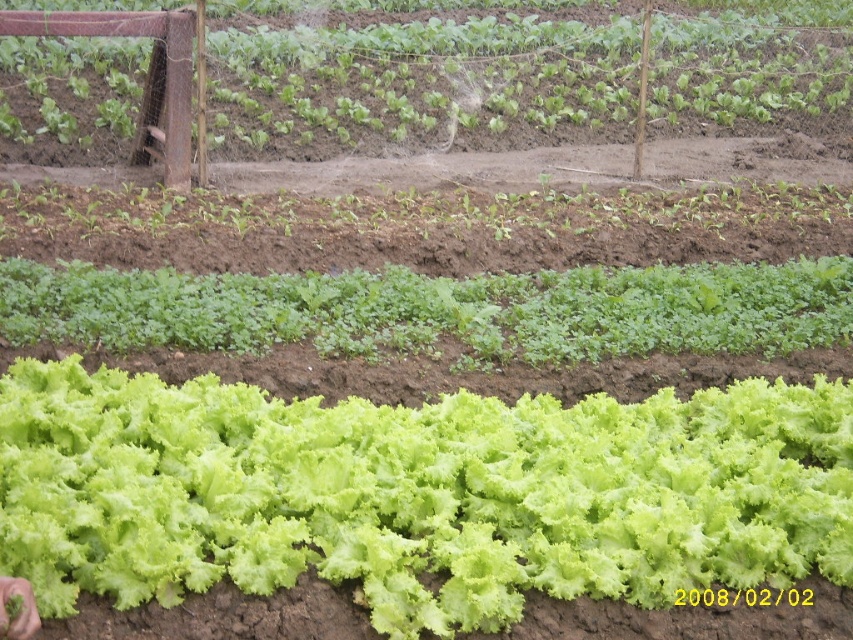
You are a gardener checking the growth of plants in the vegetable garden. You notice the green leafy lettuce at lower center and the green leafy at center. Which one is taller?

The green leafy lettuce at lower center is taller than the green leafy at center.

You are a gardener checking the growth of plants in the vegetable garden. You notice the green leafy lettuce at lower center and the green leafy at center. Which one is smaller in size?

The green leafy lettuce at lower center is smaller in size compared to the green leafy at center.